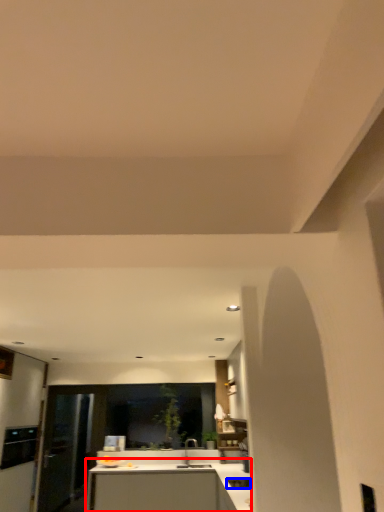
Question: Which object is further to the camera taking this photo, countertop (highlighted by a red box) or appliance (highlighted by a blue box)?

Choices:
 (A) countertop
 (B) appliance

Answer: (A)